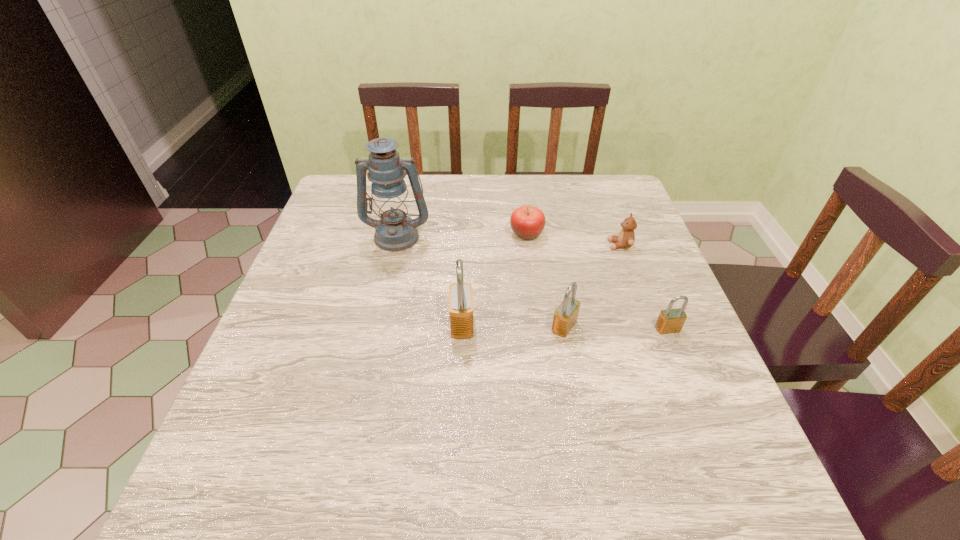
At what (x,y) coordinates should I click in order to perform the action: click on vacant space that satisfies the following two spatial constraints: 1. on the front-facing side of the tallest object; 2. on the left side of the second padlock from left to right. Please return your answer as a coordinate pair (x, y). This screenshot has height=540, width=960. Looking at the image, I should click on tap(377, 326).

Identify the location of free space that satisfies the following two spatial constraints: 1. on the front-facing side of the teddy bear; 2. on the back side of the shortest padlock. (650, 329).

In order to click on vacant position in the image that satisfies the following two spatial constraints: 1. on the front-facing side of the fifth object from right to left; 2. on the right side of the lantern in this screenshot , I will do `click(377, 324)`.